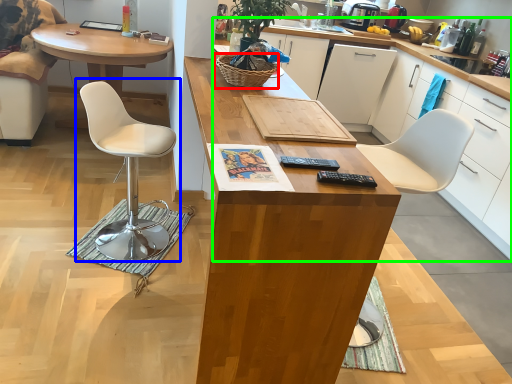
Question: Based on their relative distances, which object is farther from picnic basket (highlighted by a red box)? Choose from chair (highlighted by a blue box) and cabinetry (highlighted by a green box).

Choices:
 (A) chair
 (B) cabinetry

Answer: (B)